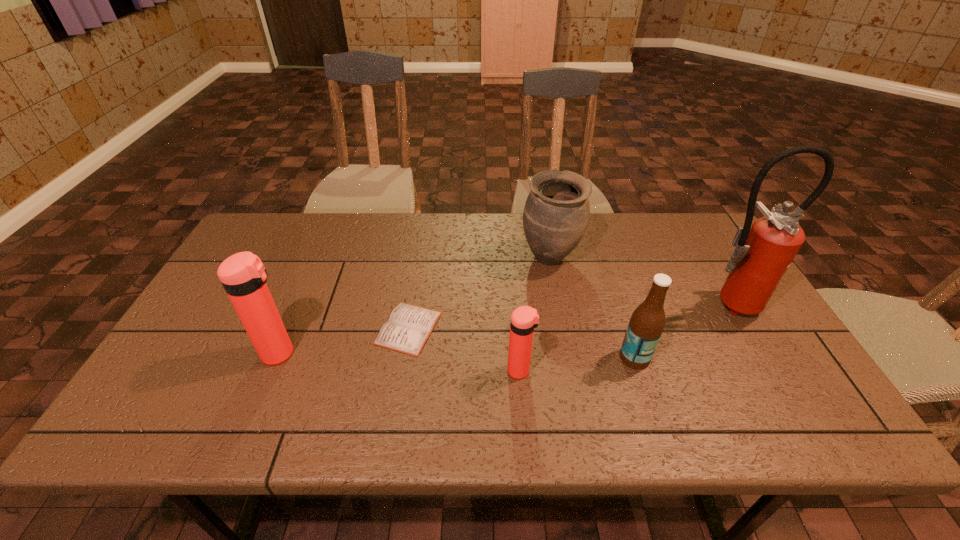
Where is `vacant space in between the farthest object and the left thermos bottle`? vacant space in between the farthest object and the left thermos bottle is located at coordinates (415, 306).

Image resolution: width=960 pixels, height=540 pixels. Identify the location of vacant region between the second object from right to left and the fire extinguisher. (681, 331).

This screenshot has width=960, height=540. What are the coordinates of `empty space that is in between the beer bottle and the taller thermos bottle` in the screenshot? It's located at (457, 356).

Choose which object is the nearest neighbor to the shortest object. Please provide its 2D coordinates. Your answer should be formatted as a tuple, i.e. [(x, y)], where the tuple contains the x and y coordinates of a point satisfying the conditions above.

[(524, 319)]

This screenshot has height=540, width=960. What are the coordinates of `object that is the fourth closest to the urn` in the screenshot? It's located at pyautogui.click(x=524, y=319).

Identify the location of free point that satisfies the following two spatial constraints: 1. on the back side of the right thermos bottle; 2. on the left side of the farthest object. The height and width of the screenshot is (540, 960). (511, 258).

Locate an element on the screen. The height and width of the screenshot is (540, 960). vacant space that satisfies the following two spatial constraints: 1. on the front side of the fifth tallest object; 2. on the left side of the leftmost object is located at coordinates (273, 371).